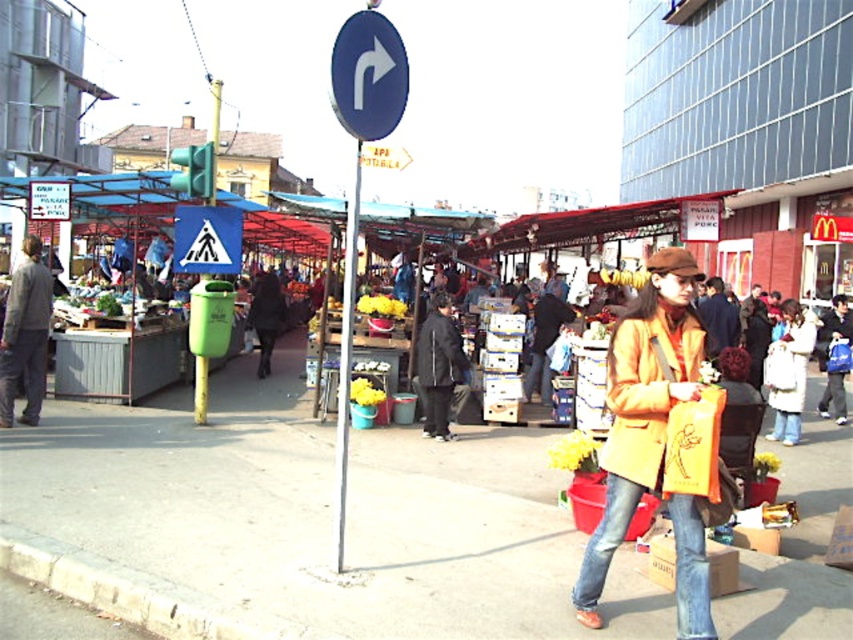
Question: Which of the following is the closest to the observer?

Choices:
 (A) (616, 358)
 (B) (339, 38)

Answer: (A)

Question: Is matte yellow trench coat at center to the right of matte gray suit at left from the viewer's perspective?

Choices:
 (A) yes
 (B) no

Answer: (A)

Question: Does matte yellow trench coat at center have a greater width compared to brown leather jacket at center?

Choices:
 (A) yes
 (B) no

Answer: (B)

Question: Does matte yellow trench coat at center appear on the right side of blue glossy sign at upper center?

Choices:
 (A) no
 (B) yes

Answer: (B)

Question: Which of the following is the closest to the observer?

Choices:
 (A) blue glossy sign at upper center
 (B) blue metallic sign at center
 (C) dark gray jacket at center
 (D) brown leather jacket at center

Answer: (A)

Question: Which of these objects is positioned closest to the blue metallic sign at center?

Choices:
 (A) dark gray jacket at center
 (B) brown leather jacket at center
 (C) blue glossy sign at upper center
 (D) white fuzzy coat at lower right

Answer: (C)